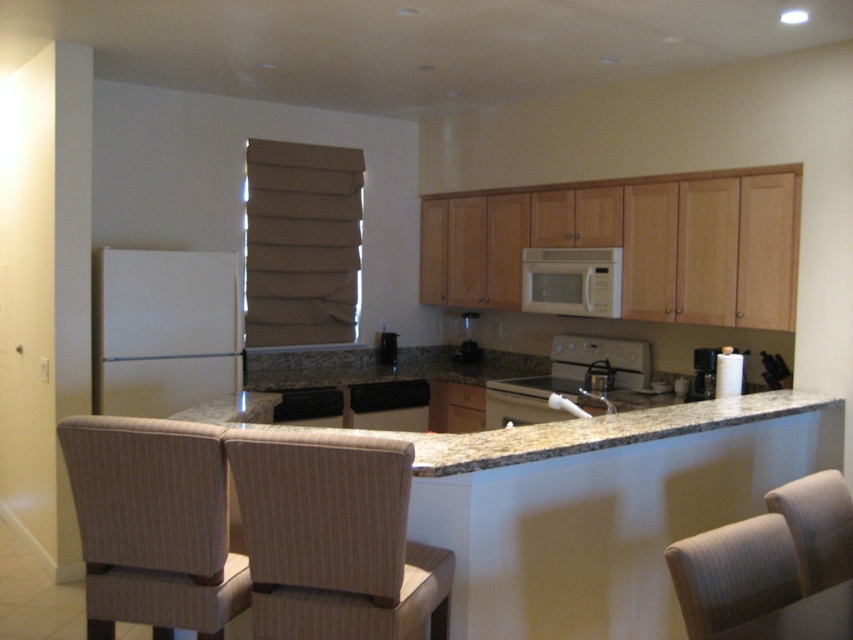
Question: Can you confirm if beige striped armchair at lower right is positioned to the left of satin black coffee maker at center?

Choices:
 (A) yes
 (B) no

Answer: (B)

Question: Considering the real-world distances, which object is closest to the beige fabric armchair at lower right?

Choices:
 (A) white matte refrigerator at left
 (B) black matte dishwasher at center
 (C) white glossy kettle at center

Answer: (C)

Question: Is beige striped armchair at lower right positioned before white matte microwave at upper center?

Choices:
 (A) no
 (B) yes

Answer: (B)

Question: Which object appears farthest from the camera in this image?

Choices:
 (A) brown woven armchair at center
 (B) brown fabric armchair at lower left

Answer: (B)

Question: Is brown fabric armchair at lower left to the left of white glossy kettle at center from the viewer's perspective?

Choices:
 (A) no
 (B) yes

Answer: (B)

Question: Among these objects, which one is farthest from the camera?

Choices:
 (A) beige striped armchair at lower right
 (B) black matte dishwasher at center
 (C) brown fabric armchair at lower left
 (D) satin black coffee maker at center

Answer: (D)